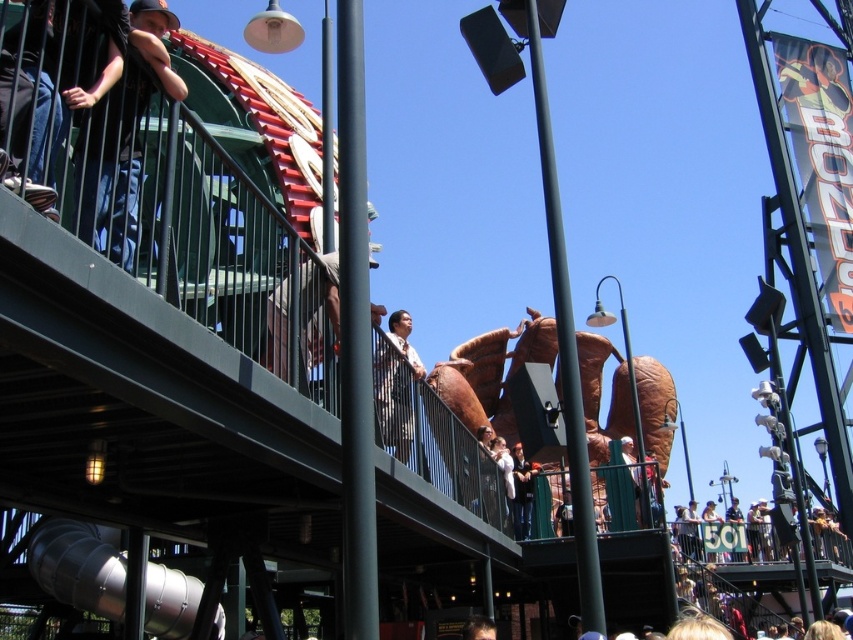
Question: Which of the following is the closest to the observer?

Choices:
 (A) (519, 522)
 (B) (376, 392)

Answer: (B)

Question: Can you confirm if light brown shirt at center is wider than white cotton jacket at center?

Choices:
 (A) no
 (B) yes

Answer: (B)

Question: Which of the following is the closest to the observer?

Choices:
 (A) light brown shirt at center
 (B) white cotton jacket at center

Answer: (A)

Question: Can you confirm if light brown shirt at center is positioned above white cotton jacket at center?

Choices:
 (A) yes
 (B) no

Answer: (A)

Question: Among these objects, which one is farthest from the camera?

Choices:
 (A) light brown shirt at center
 (B) white cotton jacket at center

Answer: (B)

Question: Where is light brown shirt at center located in relation to white cotton jacket at center in the image?

Choices:
 (A) above
 (B) below

Answer: (A)